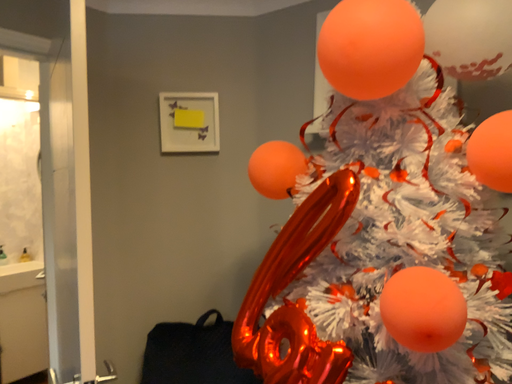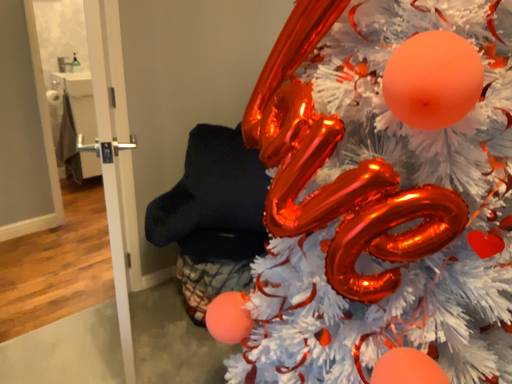
Question: How did the camera likely rotate when shooting the video?

Choices:
 (A) rotated right
 (B) rotated left

Answer: (B)